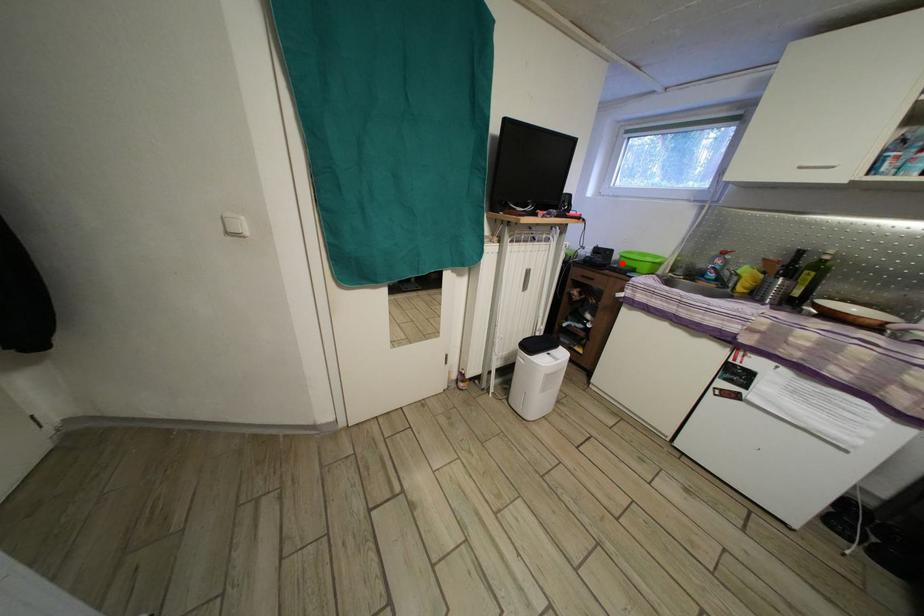
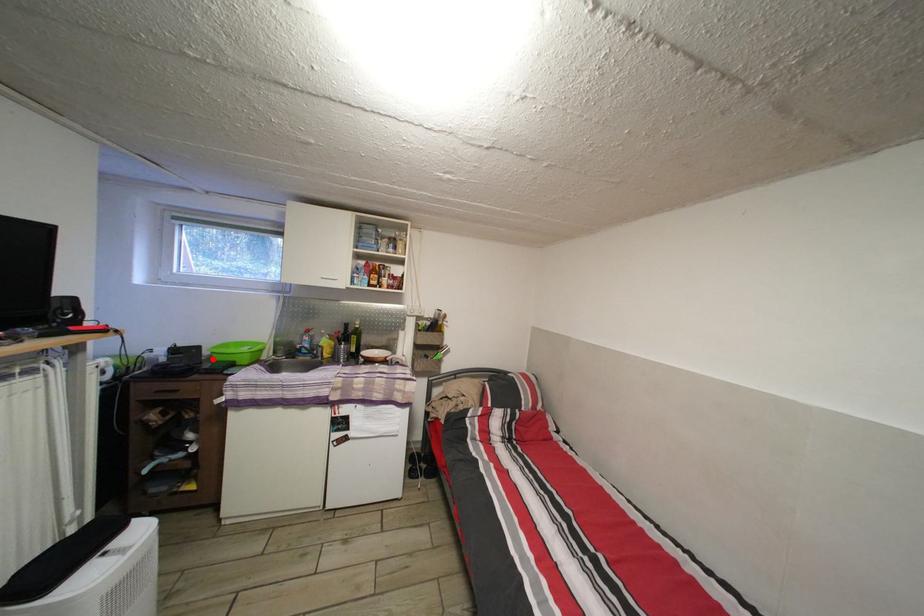
I am providing you with two images of the same scene from different viewpoints. A red point is marked on the first image and another point is marked on the second image. Is the red point in image1 aligned with the point shown in image2?

Yes